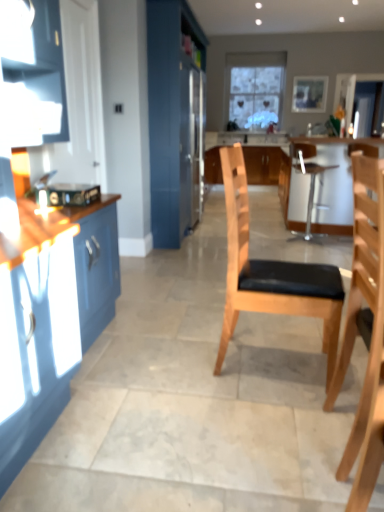
Where is `free area in between light wood/black cushioned chair at center, the 3th chair from the right, and natural wood chair at center, marked as the first chair in a front-to-back arrangement`? free area in between light wood/black cushioned chair at center, the 3th chair from the right, and natural wood chair at center, marked as the first chair in a front-to-back arrangement is located at coordinates (291, 410).